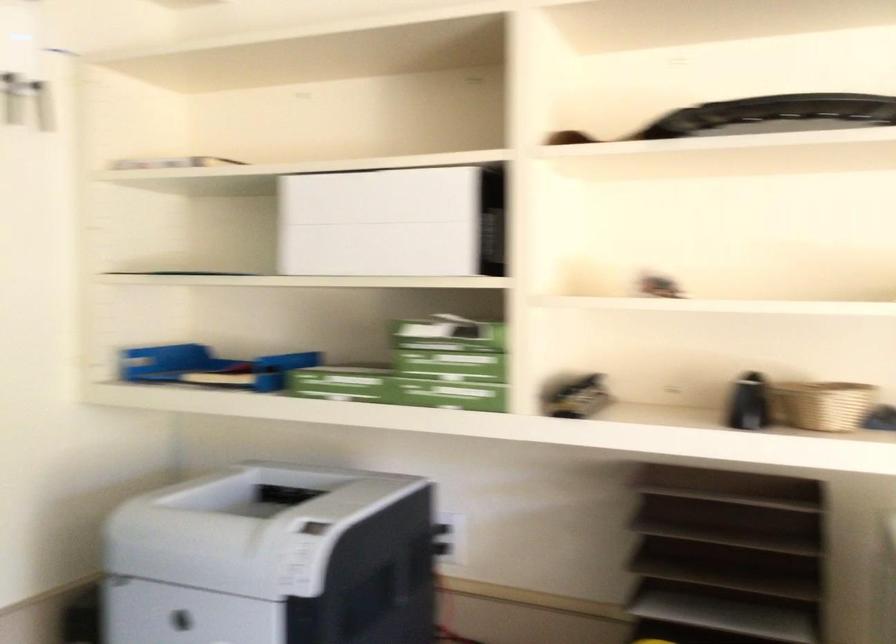
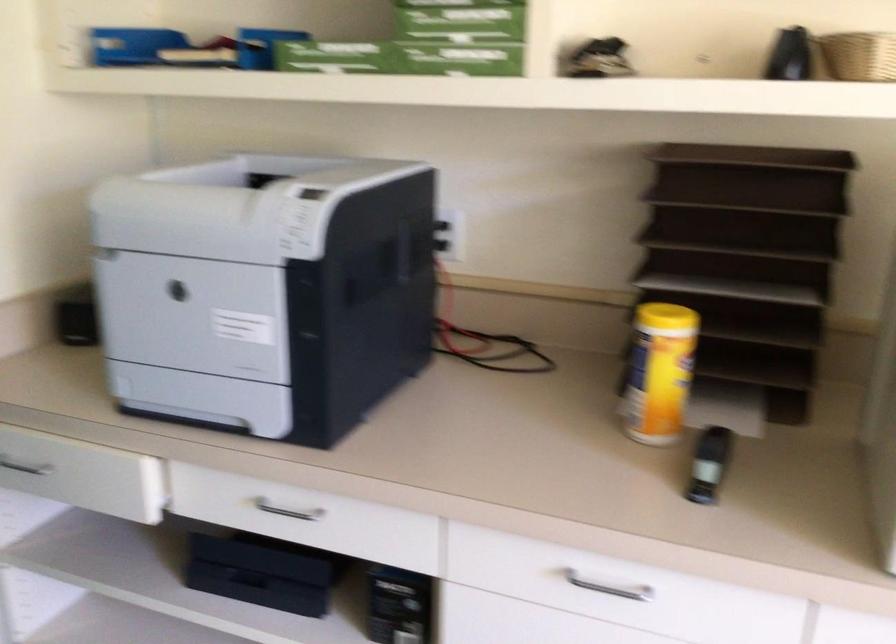
Locate, in the second image, the point that corresponds to point 192,363 in the first image.

(165, 49)